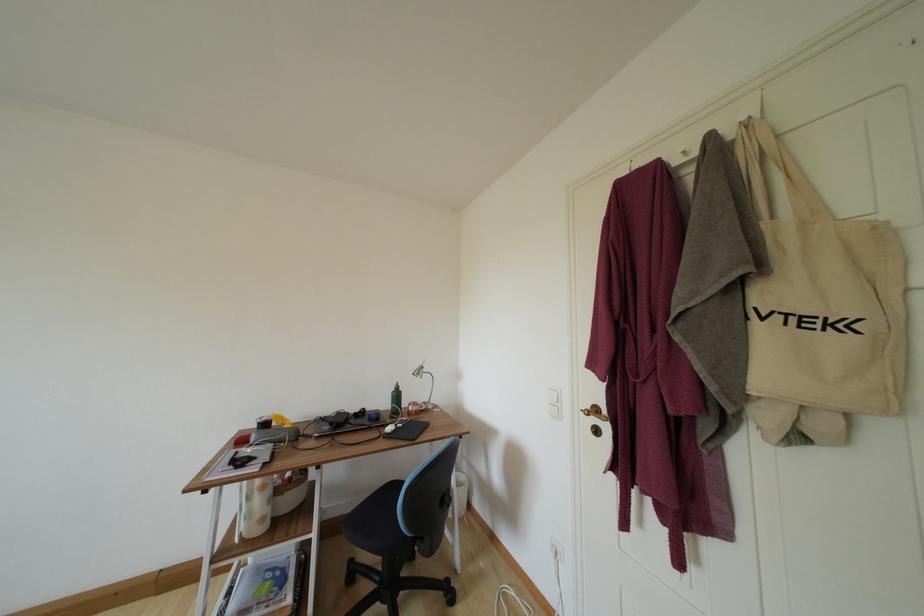
Where is `silver desk lamp`? This screenshot has width=924, height=616. silver desk lamp is located at coordinates (426, 384).